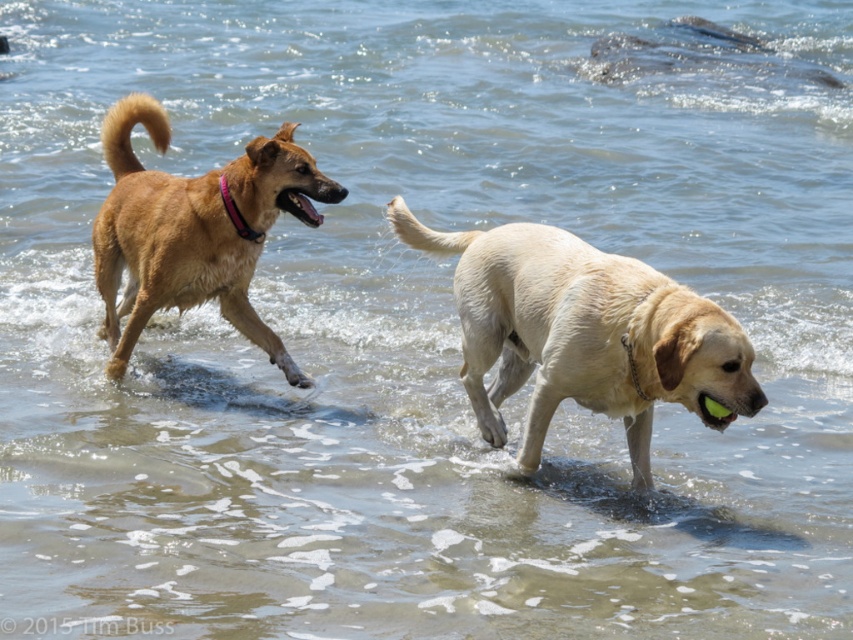
You are a photographer trying to capture both the golden fur dog at center and the brown furry dog at left in a single frame. Given their sizes, which dog would require more space in the photo to avoid being cropped?

The golden fur dog at center is wider than the brown furry dog at left, so it would require more space in the photo to avoid being cropped.

You are a photographer trying to capture a group photo of the golden fur dog at center and the brown furry dog at left. Your camera can only focus on subjects within a 3 feet range. Can you take a photo of both dogs without moving them?

The distance between the golden fur dog at center and the brown furry dog at left is 3.79 feet. Since the camera can only focus within 3 feet, the dogs are slightly out of range. You might need to move them closer or adjust your camera settings to capture both in focus.

You are a photographer aiming to capture both the golden fur dog at center and the brown furry dog at left in a single shot. Based on their positions, which dog should you focus on first to ensure both are in frame?

The golden fur dog at center is below the brown furry dog at left, so you should focus on the brown furry dog at left first to ensure both are in frame.